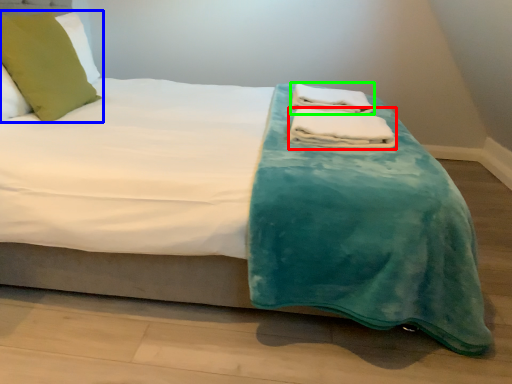
Question: Considering the real-world distances, which object is farthest from bath towel (highlighted by a red box)? pillow (highlighted by a blue box) or bath towel (highlighted by a green box)?

Choices:
 (A) pillow
 (B) bath towel

Answer: (A)